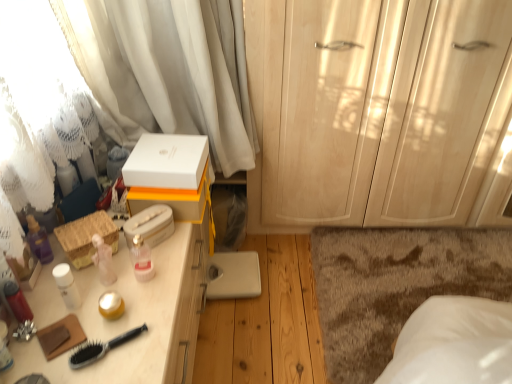
You are a GUI agent. You are given a task and a screenshot of the screen. Output one action in this format:
    pyautogui.click(x=<x>, y=<y>)
    Task: Click on the vacant area that is situated to the right of matte white lotion at left, placed as the 1th toiletry when sorted from left to right
    
    Given the screenshot: What is the action you would take?
    pyautogui.click(x=61, y=359)